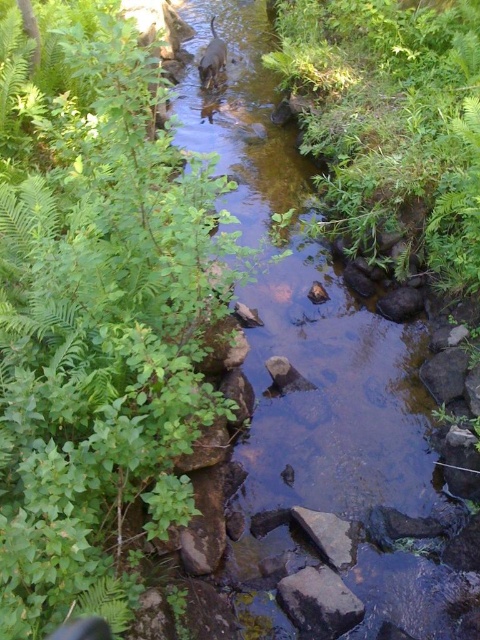
Who is more forward, (294,278) or (320,611)?

Point (320,611) is more forward.

Can you confirm if clear water stream at center is positioned to the left of gray rough rock at center?

No, clear water stream at center is not to the left of gray rough rock at center.

Which is behind, point (292, 428) or point (333, 600)?

Point (292, 428)

Locate an element on the screen. The image size is (480, 640). clear water stream at center is located at coordinates (351, 456).

Is point (99, 435) less distant than point (339, 448)?

Yes, point (99, 435) is closer to viewer.

What do you see at coordinates (96, 307) in the screenshot? The height and width of the screenshot is (640, 480). I see `green leafy plant at center` at bounding box center [96, 307].

You are a GUI agent. You are given a task and a screenshot of the screen. Output one action in this format:
    pyautogui.click(x=<x>, y=<y>)
    Task: Click on the green leafy plant at center
    The image size is (480, 640).
    Given the screenshot: What is the action you would take?
    coord(96,307)

Locate an element on the screen. This screenshot has width=480, height=640. clear water stream at center is located at coordinates [x=351, y=456].

Is clear water stream at center shorter than brown fur dog at center?

In fact, clear water stream at center may be taller than brown fur dog at center.

Where is `clear water stream at center`? This screenshot has width=480, height=640. clear water stream at center is located at coordinates (351, 456).

You are a GUI agent. You are given a task and a screenshot of the screen. Output one action in this format:
    pyautogui.click(x=<x>, y=<y>)
    Task: Click on the clear water stream at center
    The height and width of the screenshot is (640, 480).
    Given the screenshot: What is the action you would take?
    pyautogui.click(x=351, y=456)